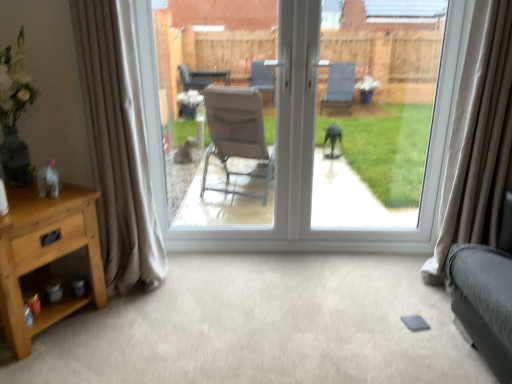
Image resolution: width=512 pixels, height=384 pixels. Find the location of `spots to the right of light brown wood nightstand at lower left`. spots to the right of light brown wood nightstand at lower left is located at coordinates (120, 336).